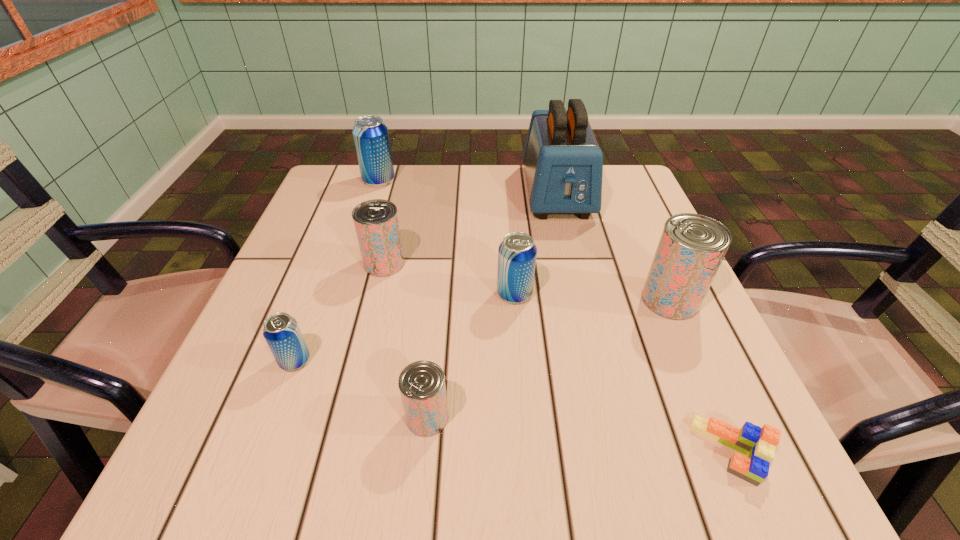
Identify the location of object that is the closest to the second farthest beer can. [281, 331].

Locate an element on the screen. Image resolution: width=960 pixels, height=540 pixels. beer can identified as the third closest to the second nearest beer can is located at coordinates (517, 253).

Locate which beer can is the fifth closest to the nearest blue beer can. Please provide its 2D coordinates. Your answer should be formatted as a tuple, i.e. [(x, y)], where the tuple contains the x and y coordinates of a point satisfying the conditions above.

[(691, 248)]

The image size is (960, 540). Find the location of `the second closest blue beer can to the nearest blue beer can`. the second closest blue beer can to the nearest blue beer can is located at coordinates point(371,137).

This screenshot has width=960, height=540. Find the location of `blue beer can that is the second closest to the shortest object`. blue beer can that is the second closest to the shortest object is located at coordinates (281, 331).

You are a GUI agent. You are given a task and a screenshot of the screen. Output one action in this format:
    pyautogui.click(x=<x>, y=<y>)
    Task: Click on the closest red beer can to the biggest red beer can
    Image resolution: width=960 pixels, height=540 pixels.
    Given the screenshot: What is the action you would take?
    pyautogui.click(x=422, y=387)

Where is `the second closest red beer can to the rightmost red beer can`? the second closest red beer can to the rightmost red beer can is located at coordinates (376, 223).

Find the location of a particular element. The height and width of the screenshot is (540, 960). vacant space that satisfies the following two spatial constraints: 1. on the front side of the farthest beer can; 2. on the left side of the second nearest red beer can is located at coordinates (341, 300).

Where is `free space that satisfies the following two spatial constraints: 1. on the back side of the fifth nearest beer can; 2. on the right side of the nearest blue beer can`? Image resolution: width=960 pixels, height=540 pixels. free space that satisfies the following two spatial constraints: 1. on the back side of the fifth nearest beer can; 2. on the right side of the nearest blue beer can is located at coordinates (331, 264).

You are a GUI agent. You are given a task and a screenshot of the screen. Output one action in this format:
    pyautogui.click(x=<x>, y=<y>)
    Task: Click on the vacant space that satisfies the following two spatial constraints: 1. on the front-facing side of the toaster; 2. on the right side of the rightmost red beer can
    This screenshot has width=960, height=540.
    Given the screenshot: What is the action you would take?
    (583, 300)